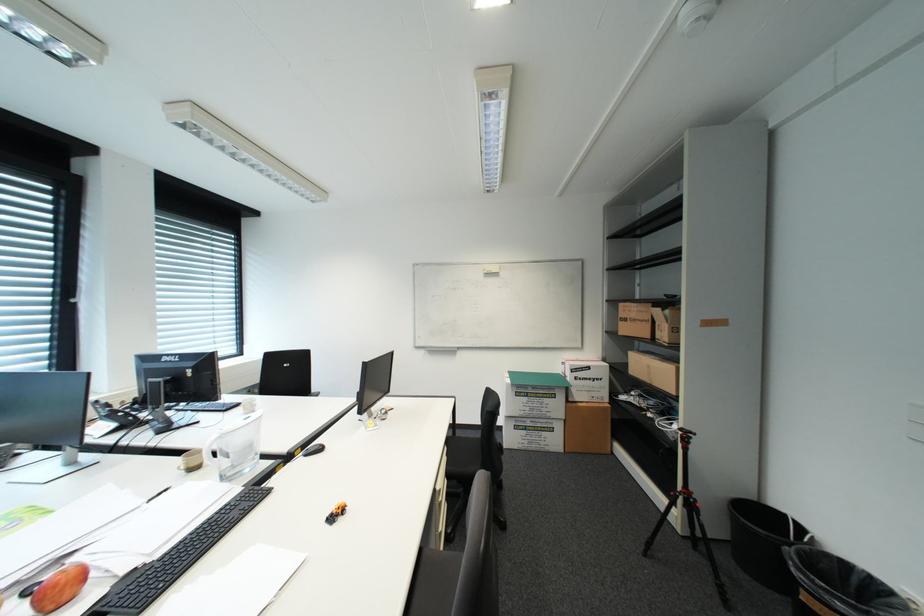
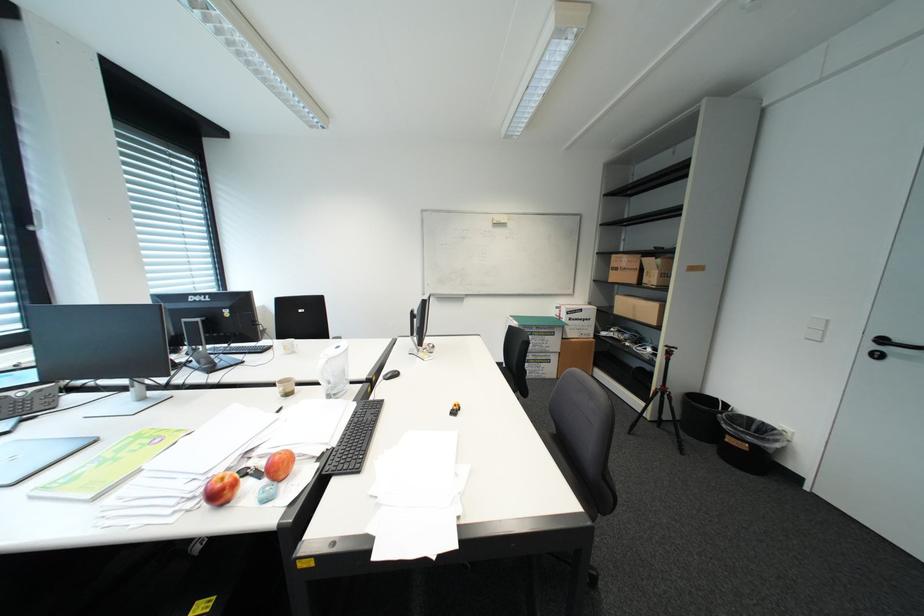
Question: In a continuous first-person perspective shot, in which direction is the camera moving?

Choices:
 (A) Left
 (B) Right
 (C) Forward
 (D) Backward

Answer: (A)